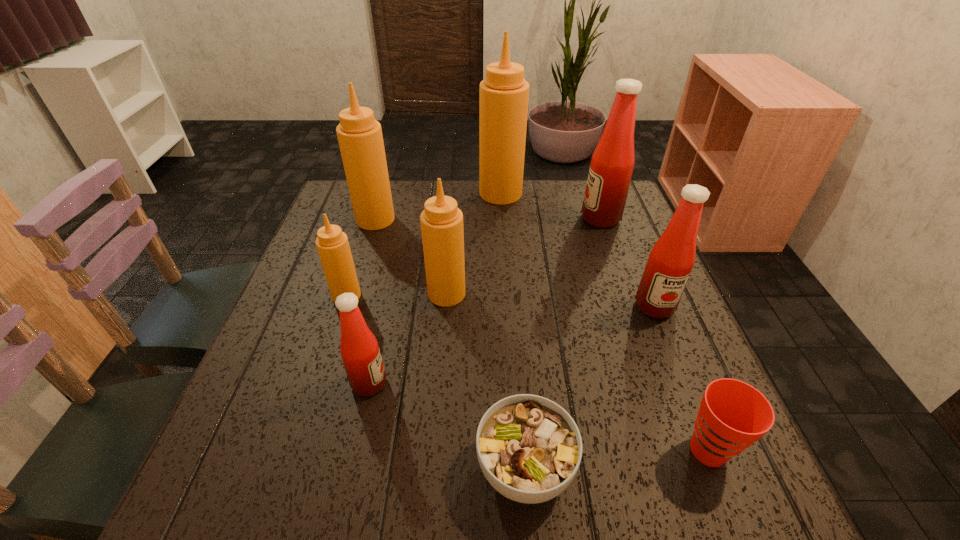
Locate an element on the screen. the biggest tan condiment is located at coordinates (504, 93).

Find the location of `the farthest object`. the farthest object is located at coordinates (504, 93).

Where is `the biggest red condiment`? the biggest red condiment is located at coordinates [612, 163].

This screenshot has width=960, height=540. Find the location of `the second biggest tan condiment`. the second biggest tan condiment is located at coordinates (360, 138).

Where is `the third tan condiment from left to right`? The width and height of the screenshot is (960, 540). the third tan condiment from left to right is located at coordinates (442, 230).

Where is `the fourth condiment from right to left`? This screenshot has width=960, height=540. the fourth condiment from right to left is located at coordinates 442,230.

Where is `the second smallest red condiment`? This screenshot has height=540, width=960. the second smallest red condiment is located at coordinates (671, 260).

Where is `the smallest tan condiment`? The height and width of the screenshot is (540, 960). the smallest tan condiment is located at coordinates (332, 244).

At what (x,y) coordinates should I click in order to perform the action: click on the seventh farthest object. Please return your answer as a coordinate pair (x, y). The height and width of the screenshot is (540, 960). Looking at the image, I should click on (360, 352).

Find the location of a particular element. the smallest red condiment is located at coordinates (360, 352).